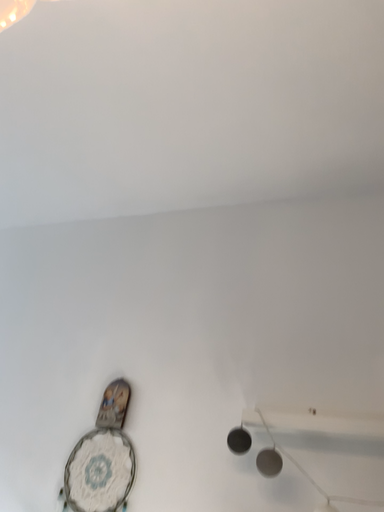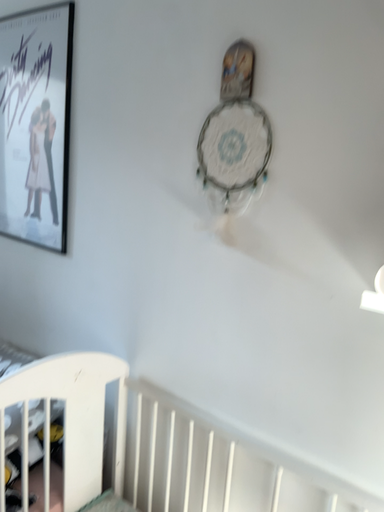
Question: Which way did the camera rotate in the video?

Choices:
 (A) rotated left
 (B) rotated right

Answer: (A)